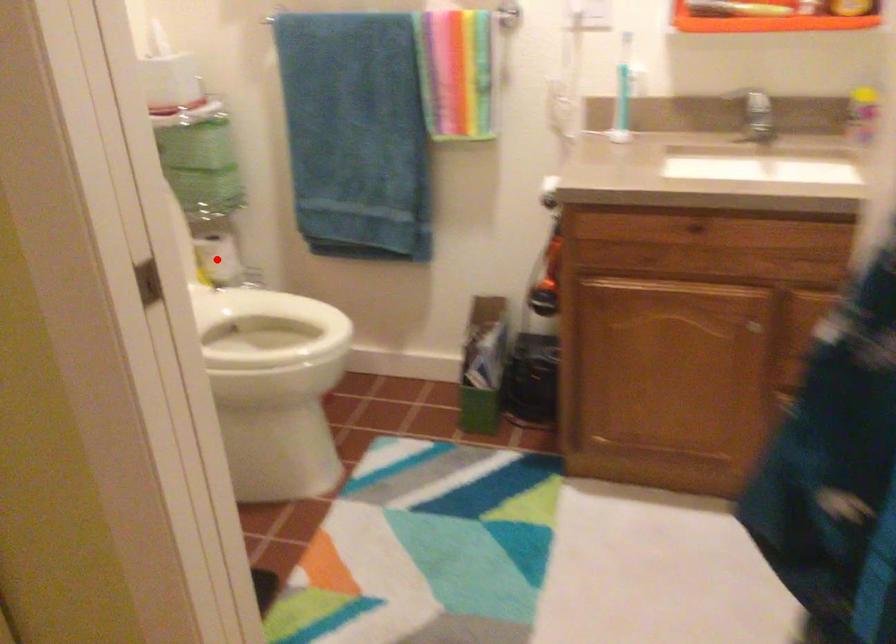
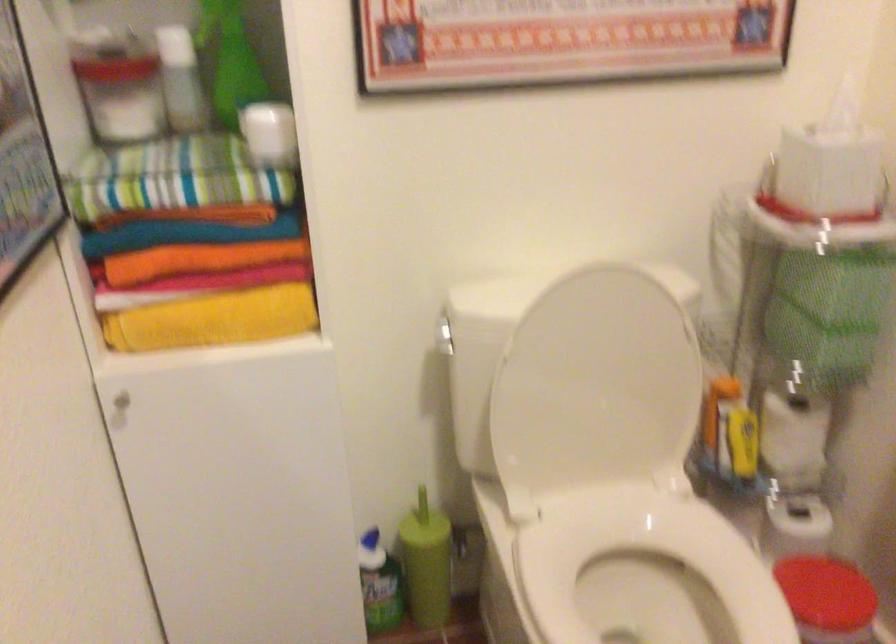
Question: I am providing you with two images of the same scene from different viewpoints. A red point is marked on the first image. Is the red point's position out of view in image 2?

Choices:
 (A) Yes
 (B) No

Answer: (B)